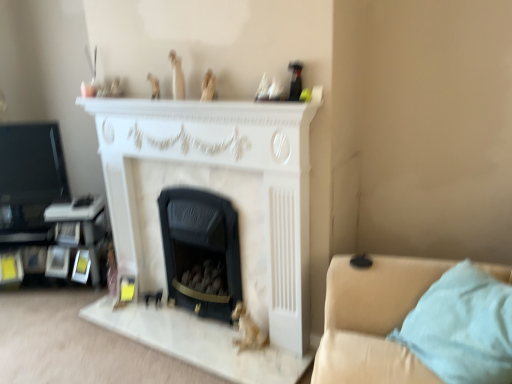
Question: Which direction should I rotate to look at black matte fireplace at center, positioned as the 1th fireplace in right-to-left order?

Choices:
 (A) left
 (B) right

Answer: (A)

Question: Does wooden figurine at upper center, the third toy positioned from the bottom, contain black matte fireplace at center, positioned as the 1th fireplace in right-to-left order?

Choices:
 (A) no
 (B) yes

Answer: (A)

Question: From a real-world perspective, is wooden figurine at upper center, which ranks as the 4th toy in right-to-left order, beneath black matte fireplace at center, positioned as the 1th fireplace in right-to-left order?

Choices:
 (A) no
 (B) yes

Answer: (A)

Question: Does wooden figurine at upper center, which appears as the 2th toy when viewed from the top, have a smaller size compared to black matte fireplace at center, which is the second fireplace from left to right?

Choices:
 (A) yes
 (B) no

Answer: (A)

Question: Is the position of wooden figurine at upper center, the 1th toy viewed from the left, more distant than that of black matte fireplace at center, which is the second fireplace from left to right?

Choices:
 (A) no
 (B) yes

Answer: (B)

Question: Does wooden figurine at upper center, which appears as the 2th toy when viewed from the top, have a lesser width compared to black matte fireplace at center, which is the second fireplace from left to right?

Choices:
 (A) no
 (B) yes

Answer: (B)

Question: Can you confirm if wooden figurine at upper center, the 1th toy viewed from the left, is taller than black matte fireplace at center, positioned as the 1th fireplace in right-to-left order?

Choices:
 (A) no
 (B) yes

Answer: (A)

Question: Are matte beige figurine at upper center, which is the 3th toy in top-to-bottom order, and black matte fireplace at center, which is the second fireplace from left to right, located far from each other?

Choices:
 (A) yes
 (B) no

Answer: (B)

Question: From a real-world perspective, is matte beige figurine at upper center, acting as the second toy starting from the bottom, located beneath black matte fireplace at center, positioned as the 1th fireplace in right-to-left order?

Choices:
 (A) no
 (B) yes

Answer: (A)

Question: Is matte beige figurine at upper center, acting as the second toy starting from the right, completely or partially outside of black matte fireplace at center, which is the second fireplace from left to right?

Choices:
 (A) no
 (B) yes

Answer: (B)

Question: Would you say black matte fireplace at center, which is the second fireplace from left to right, is part of matte beige figurine at upper center, which is the 3th toy in top-to-bottom order,'s contents?

Choices:
 (A) no
 (B) yes

Answer: (A)

Question: Considering the relative sizes of matte beige figurine at upper center, arranged as the 3th toy when viewed from the left, and black matte fireplace at center, positioned as the 1th fireplace in right-to-left order, in the image provided, is matte beige figurine at upper center, arranged as the 3th toy when viewed from the left, bigger than black matte fireplace at center, positioned as the 1th fireplace in right-to-left order,?

Choices:
 (A) yes
 (B) no

Answer: (B)

Question: Considering the relative positions of matte beige figurine at upper center, which is the 3th toy in top-to-bottom order, and black matte fireplace at center, positioned as the 1th fireplace in right-to-left order, in the image provided, is matte beige figurine at upper center, which is the 3th toy in top-to-bottom order, to the left of black matte fireplace at center, positioned as the 1th fireplace in right-to-left order, from the viewer's perspective?

Choices:
 (A) yes
 (B) no

Answer: (B)

Question: Is matte beige figurine at upper center, acting as the second toy starting from the bottom, closer to the viewer compared to gold metallic figurine at lower center, which is the fourth toy in left-to-right order?

Choices:
 (A) no
 (B) yes

Answer: (B)